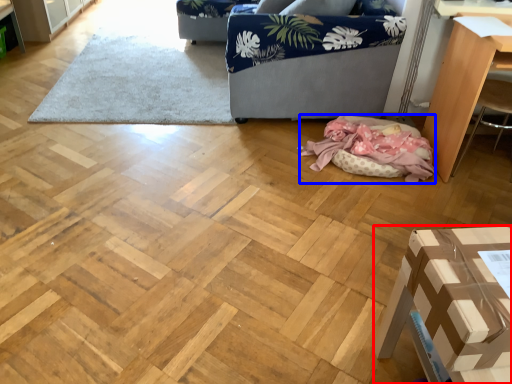
Question: Which point is closer to the camera, furniture (highlighted by a red box) or blanket (highlighted by a blue box)?

Choices:
 (A) furniture
 (B) blanket

Answer: (A)